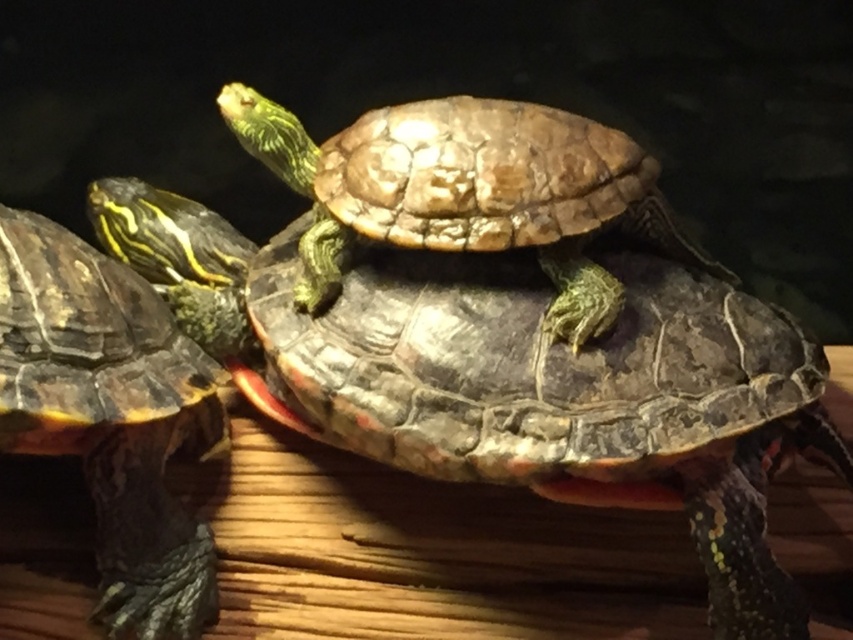
Question: Estimate the real-world distances between objects in this image. Which object is closer to the shiny black tortoise at left?

Choices:
 (A) shiny dark green tortoise at center
 (B) shiny brown tortoise at center
 (C) shiny green tortoise at center

Answer: (C)

Question: Which point is closer to the camera?

Choices:
 (A) (167, 538)
 (B) (242, 307)
 (C) (722, 564)

Answer: (C)

Question: Which point is closer to the camera?

Choices:
 (A) (737, 305)
 (B) (560, 301)

Answer: (B)

Question: Is shiny dark green tortoise at center behind shiny brown tortoise at center?

Choices:
 (A) yes
 (B) no

Answer: (B)

Question: Does shiny dark green tortoise at center have a greater width compared to shiny black tortoise at left?

Choices:
 (A) no
 (B) yes

Answer: (B)

Question: Does shiny dark green tortoise at center have a lesser width compared to shiny black tortoise at left?

Choices:
 (A) no
 (B) yes

Answer: (A)